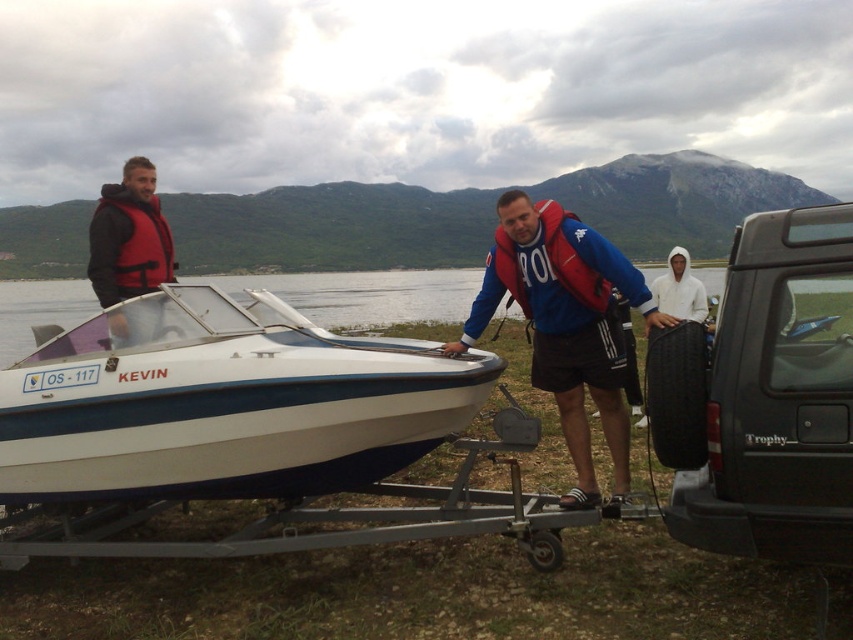
Question: Does white glossy boat at center appear on the right side of white hoodie at center?

Choices:
 (A) yes
 (B) no

Answer: (B)

Question: Which point is closer to the camera?

Choices:
 (A) (509, 273)
 (B) (767, 372)

Answer: (B)

Question: Observing the image, what is the correct spatial positioning of red fabric life vest at center in reference to white hoodie at center?

Choices:
 (A) left
 (B) right

Answer: (A)

Question: Among these points, which one is nearest to the camera?

Choices:
 (A) (109, 289)
 (B) (167, 435)
 (C) (614, 372)
 (D) (509, 275)

Answer: (B)

Question: Is black rubber tire at lower right thinner than red matte life jacket at center?

Choices:
 (A) no
 (B) yes

Answer: (A)

Question: Which object is closer to the camera taking this photo?

Choices:
 (A) white glossy boat at center
 (B) matte red life jacket at left
 (C) black rubber tire at lower right
 (D) white hoodie at center

Answer: (C)